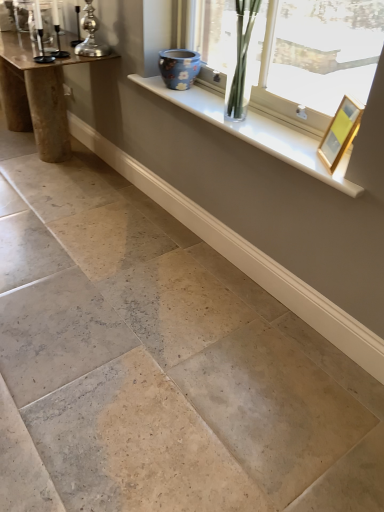
Question: Is natural stone floor at center inside or outside of blue floral ceramic vase at upper center?

Choices:
 (A) outside
 (B) inside

Answer: (A)

Question: Is natural stone floor at center taller or shorter than blue floral ceramic vase at upper center?

Choices:
 (A) short
 (B) tall

Answer: (A)

Question: Which object is positioned farthest from the silver metallic candle holder at upper left, the second candle holder viewed from the left?

Choices:
 (A) clear glass vase at upper center
 (B) wooden table at left
 (C) metallic silver candle holder at left, the 1th candle holder in the left-to-right sequence
 (D) white glossy window sill at upper center
 (E) natural stone floor at center

Answer: (E)

Question: Which of these objects is positioned farthest from the silver metallic candle holder at upper left, arranged as the first candle holder when viewed from the right?

Choices:
 (A) wooden table at left
 (B) metallic silver candle holder at left, the second candle holder when ordered from right to left
 (C) clear glass vase at upper center
 (D) gold metallic picture frame at upper right
 (E) natural stone floor at center

Answer: (E)